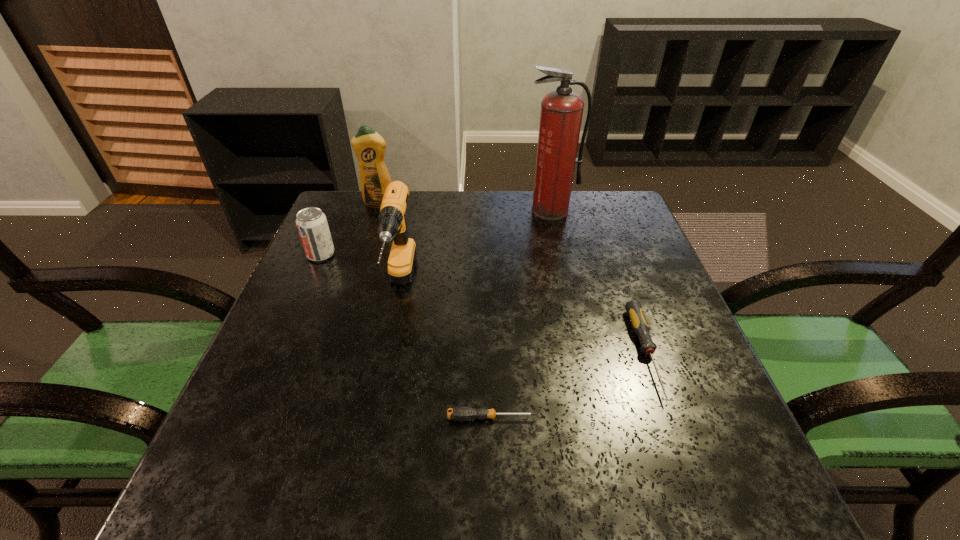
Where is `fire extinguisher`? fire extinguisher is located at coordinates (561, 113).

The width and height of the screenshot is (960, 540). What are the coordinates of `the second object from right to left` in the screenshot? It's located at (561, 113).

At what (x,y) coordinates should I click in order to perform the action: click on the fifth object from right to left. Please return your answer as a coordinate pair (x, y). This screenshot has width=960, height=540. Looking at the image, I should click on click(369, 147).

This screenshot has width=960, height=540. Identify the location of drill. (392, 221).

I want to click on soda can, so click(x=312, y=225).

This screenshot has width=960, height=540. What are the coordinates of `the leftmost object` in the screenshot? It's located at (312, 225).

Find the location of a particular element. the taller screwdriver is located at coordinates (640, 326).

The width and height of the screenshot is (960, 540). I want to click on the rightmost object, so click(x=640, y=326).

Locate an element on the screen. the nearest object is located at coordinates (461, 413).

I want to click on the shortest object, so click(461, 413).